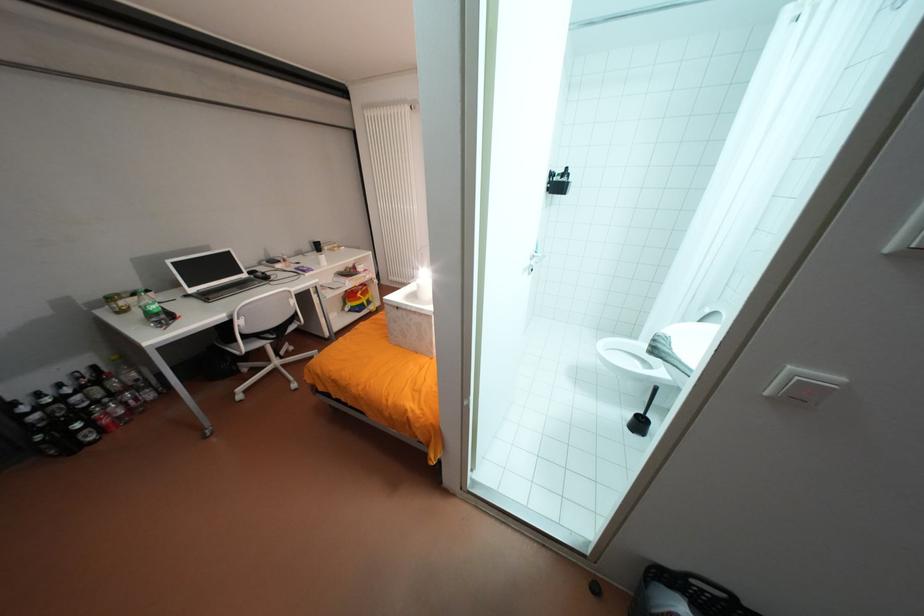
Describe the element at coordinates (804, 386) in the screenshot. I see `a white light switch` at that location.